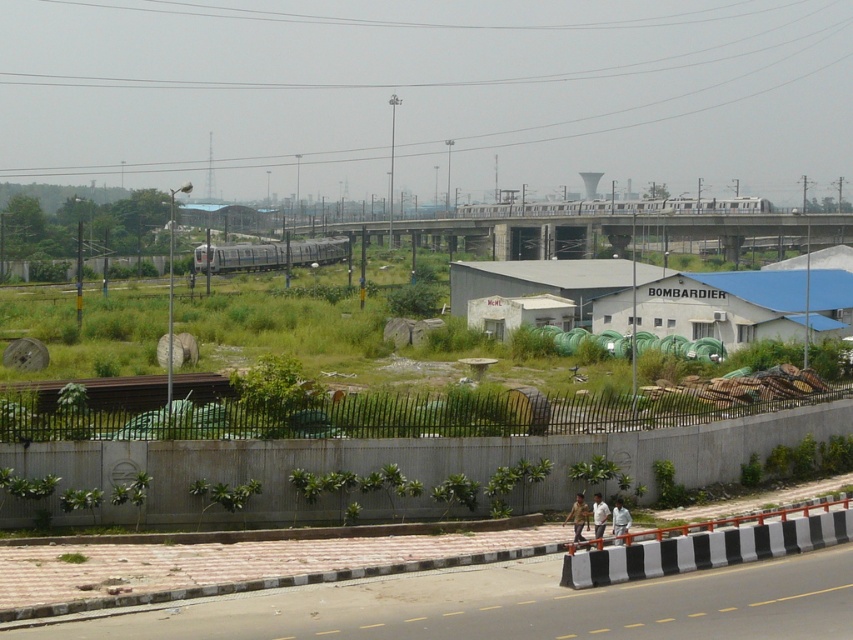
Does metal/concrete bridge at center appear on the left side of brown metallic train track at lower center?

In fact, metal/concrete bridge at center is to the right of brown metallic train track at lower center.

Which is more to the left, metal/concrete bridge at center or brown metallic train track at lower center?

brown metallic train track at lower center

Describe the element at coordinates (612, 232) in the screenshot. Image resolution: width=853 pixels, height=640 pixels. I see `metal/concrete bridge at center` at that location.

Locate an element on the screen. metal/concrete bridge at center is located at coordinates (612, 232).

Is black and white striped barrier at lower center behind brown metallic train track at lower center?

No, it is not.

Based on the photo, who is shorter, black and white striped barrier at lower center or brown metallic train track at lower center?

brown metallic train track at lower center is shorter.

Locate an element on the screen. The width and height of the screenshot is (853, 640). black and white striped barrier at lower center is located at coordinates (709, 545).

Who is more forward, (485, 230) or (288, 262)?

Point (288, 262)

Does metal/concrete bridge at center come in front of silver metallic train at center?

No, it is not.

This screenshot has height=640, width=853. In order to click on metal/concrete bridge at center in this screenshot , I will do `click(612, 232)`.

Identify the location of metal/concrete bridge at center. The width and height of the screenshot is (853, 640). (612, 232).